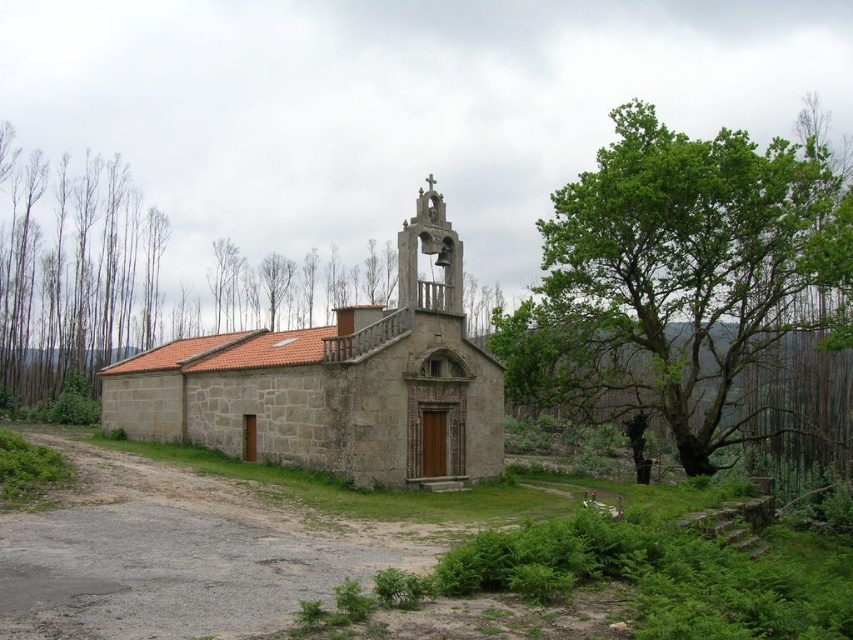
Question: Which object appears closest to the camera in this image?

Choices:
 (A) stone church at center
 (B) green leafy tree at right
 (C) bare wood trees at left

Answer: (A)

Question: Can you confirm if green leafy tree at right is positioned to the right of bare wood trees at left?

Choices:
 (A) yes
 (B) no

Answer: (A)

Question: Considering the real-world distances, which object is farthest from the bare wood trees at left?

Choices:
 (A) stone church at center
 (B) green leafy tree at right

Answer: (B)

Question: Is stone church at center positioned in front of bare wood trees at left?

Choices:
 (A) no
 (B) yes

Answer: (B)

Question: Does green leafy tree at right appear over bare wood trees at left?

Choices:
 (A) no
 (B) yes

Answer: (B)

Question: Which point is farther from the camera taking this photo?

Choices:
 (A) (84, 316)
 (B) (708, 177)

Answer: (A)